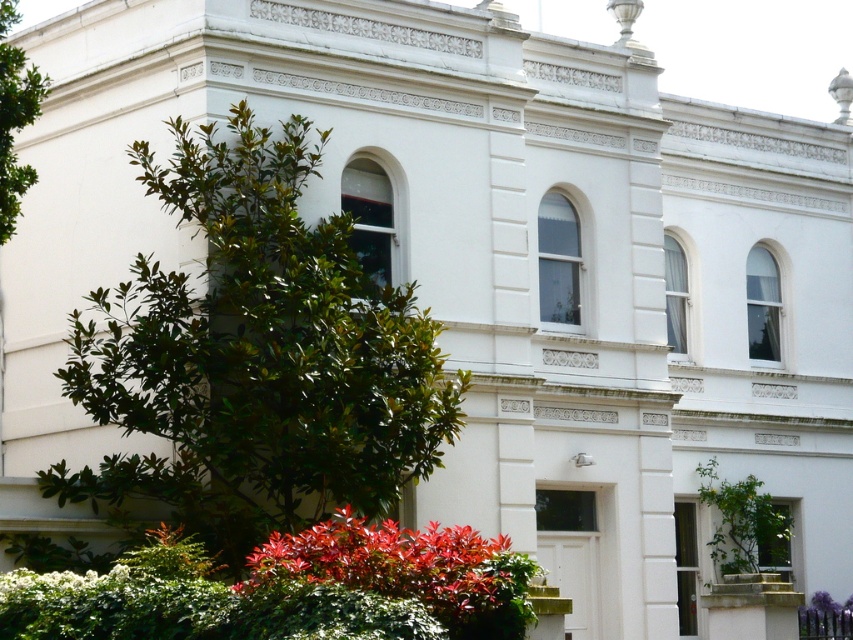
Question: Which object is the farthest from the green leafy tree at center?

Choices:
 (A) shiny red leaves at lower center
 (B) green leafy tree at left

Answer: (B)

Question: Which point is closer to the camera?

Choices:
 (A) (491, 604)
 (B) (415, 308)
 (C) (22, 168)

Answer: (A)

Question: Can you confirm if shiny red leaves at lower center is positioned to the left of green leafy tree at left?

Choices:
 (A) no
 (B) yes

Answer: (A)

Question: Can you confirm if green leafy tree at center is positioned above shiny red leaves at lower center?

Choices:
 (A) yes
 (B) no

Answer: (A)

Question: Can you confirm if shiny red leaves at lower center is positioned to the right of green leafy tree at left?

Choices:
 (A) yes
 (B) no

Answer: (A)

Question: Estimate the real-world distances between objects in this image. Which object is closer to the green leafy tree at center?

Choices:
 (A) shiny red leaves at lower center
 (B) green leafy tree at left

Answer: (A)